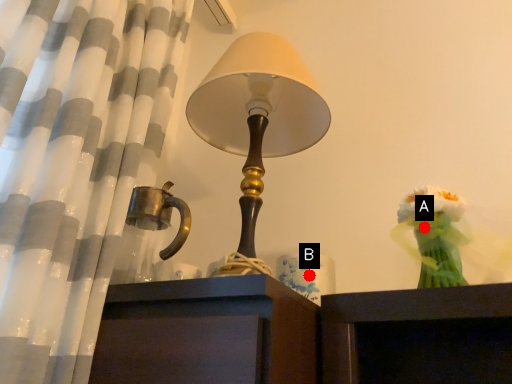
Question: Two points are circled on the image, labeled by A and B beside each circle. Which point is closer to the camera?

Choices:
 (A) A is closer
 (B) B is closer

Answer: (A)